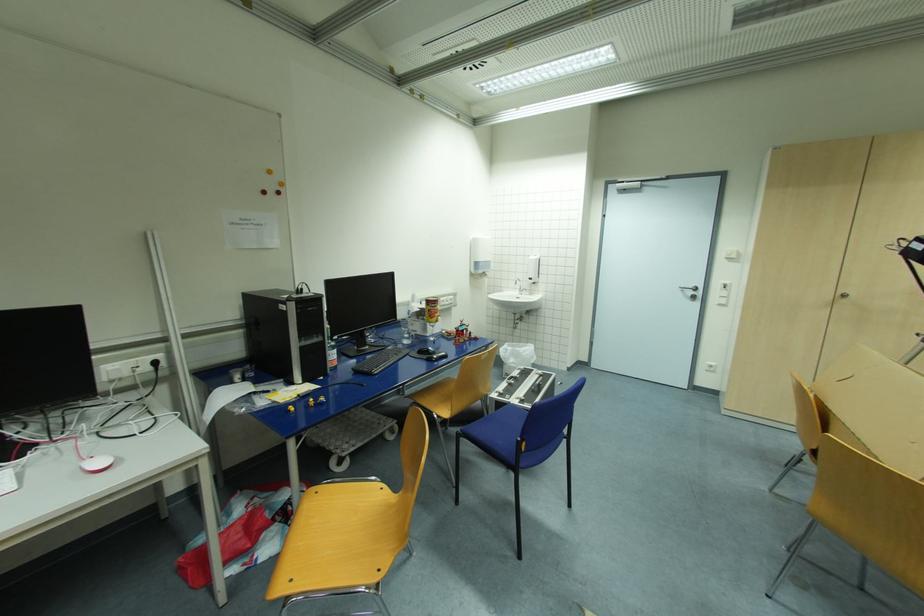
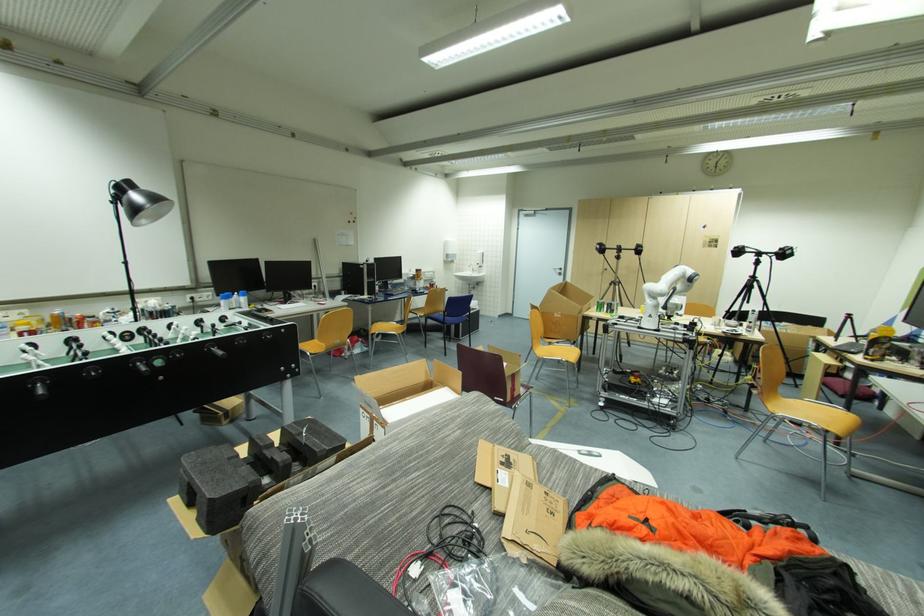
Where in the second image is the point corresponding to point (687, 294) from the first image?

(560, 273)